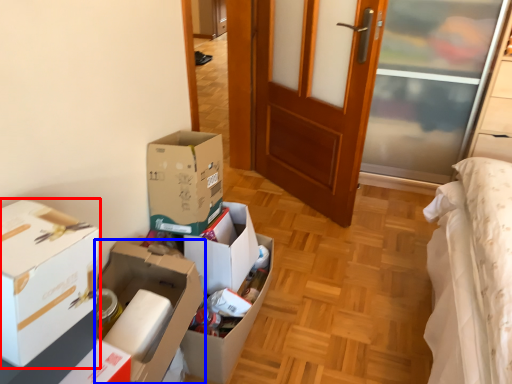
Question: Which object appears closest to the camera in this image, box (highlighted by a red box) or box (highlighted by a blue box)?

Choices:
 (A) box
 (B) box

Answer: (A)